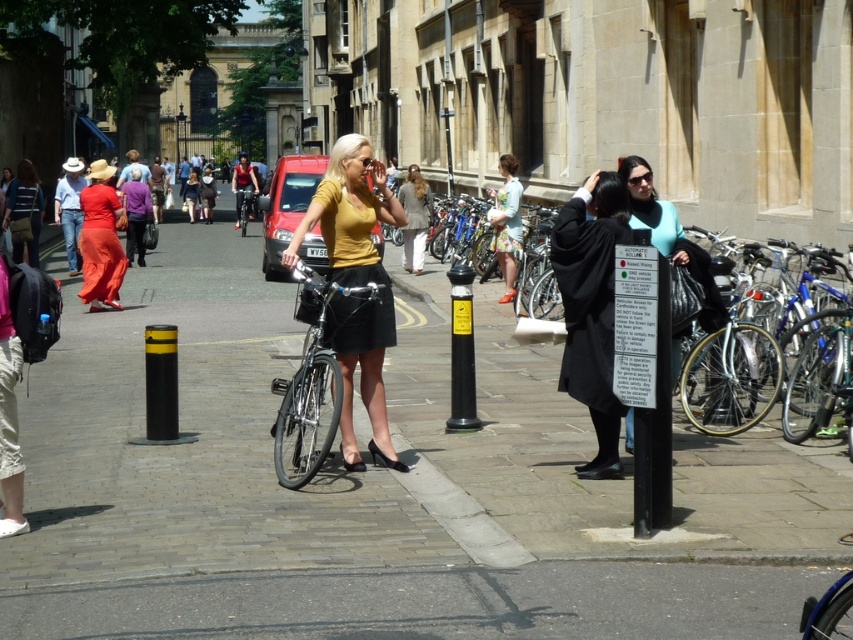
What is the location of the point at coordinates (376,492) in the urban street scene?

The point at coordinates (376,492) is located on the smooth concrete pavement at center.